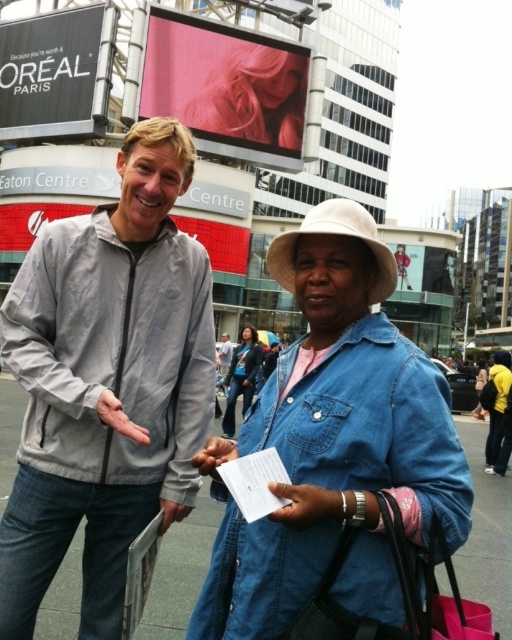
Question: Considering the real-world distances, which object is closest to the denim jacket at center?

Choices:
 (A) light gray zip-up jacket at center
 (B) denim jacket at lower right

Answer: (A)

Question: Can you confirm if light gray zip-up jacket at center is positioned below denim jacket at lower right?

Choices:
 (A) yes
 (B) no

Answer: (B)

Question: Is light gray zip-up jacket at center thinner than denim jacket at lower right?

Choices:
 (A) no
 (B) yes

Answer: (B)

Question: Which object appears closest to the camera in this image?

Choices:
 (A) denim jacket at lower right
 (B) denim jacket at center
 (C) light gray zip-up jacket at center

Answer: (A)

Question: Can you confirm if light gray zip-up jacket at center is smaller than denim jacket at center?

Choices:
 (A) yes
 (B) no

Answer: (B)

Question: Among these objects, which one is farthest from the camera?

Choices:
 (A) denim jacket at lower right
 (B) light gray zip-up jacket at center

Answer: (B)